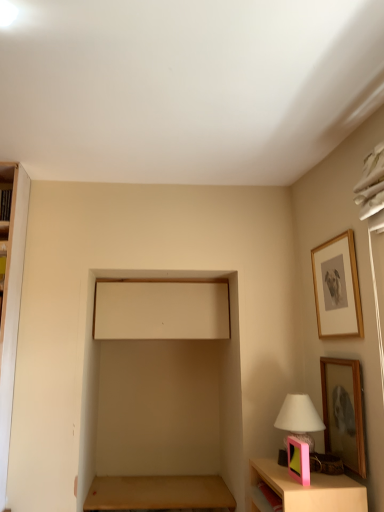
Question: From the image's perspective, does wooden picture frame at lower right, the 2th picture frame positioned from the top, appear lower than pink plastic table lamp at lower right?

Choices:
 (A) yes
 (B) no

Answer: (B)

Question: Can we say wooden picture frame at lower right, the second picture frame positioned from the right, lies outside pink plastic table lamp at lower right?

Choices:
 (A) yes
 (B) no

Answer: (A)

Question: From a real-world perspective, is wooden picture frame at lower right, the second picture frame positioned from the right, below pink plastic table lamp at lower right?

Choices:
 (A) no
 (B) yes

Answer: (A)

Question: Is the surface of wooden picture frame at lower right, the second picture frame positioned from the right, in direct contact with pink plastic table lamp at lower right?

Choices:
 (A) no
 (B) yes

Answer: (A)

Question: Considering the relative sizes of wooden picture frame at lower right, the 2th picture frame positioned from the top, and pink plastic table lamp at lower right in the image provided, is wooden picture frame at lower right, the 2th picture frame positioned from the top, thinner than pink plastic table lamp at lower right?

Choices:
 (A) yes
 (B) no

Answer: (A)

Question: Relative to pink plastic picture frame at lower right, which is the first picture frame in bottom-to-top order, is pink plastic table lamp at lower right in front or behind?

Choices:
 (A) behind
 (B) front

Answer: (A)

Question: Considering the relative positions of pink plastic table lamp at lower right and pink plastic picture frame at lower right, the third picture frame when ordered from top to bottom, in the image provided, is pink plastic table lamp at lower right to the left or to the right of pink plastic picture frame at lower right, the third picture frame when ordered from top to bottom,?

Choices:
 (A) left
 (B) right

Answer: (B)

Question: Is pink plastic table lamp at lower right wider or thinner than pink plastic picture frame at lower right, the third picture frame when ordered from top to bottom?

Choices:
 (A) wide
 (B) thin

Answer: (A)

Question: Looking at the image, does pink plastic table lamp at lower right seem bigger or smaller compared to pink plastic picture frame at lower right, the third picture frame viewed from the right?

Choices:
 (A) small
 (B) big

Answer: (B)

Question: Is brown wooden table at lower center to the left or to the right of wooden picture frame at lower right, positioned as the second picture frame in bottom-to-top order, in the image?

Choices:
 (A) left
 (B) right

Answer: (A)

Question: Is point (137, 492) closer or farther from the camera than point (327, 394)?

Choices:
 (A) closer
 (B) farther

Answer: (B)

Question: In the image, is brown wooden table at lower center positioned in front of or behind wooden picture frame at lower right, the second picture frame positioned from the right?

Choices:
 (A) front
 (B) behind

Answer: (B)

Question: Based on their sizes in the image, would you say brown wooden table at lower center is bigger or smaller than wooden picture frame at lower right, the second picture frame positioned from the right?

Choices:
 (A) big
 (B) small

Answer: (A)

Question: From the image's perspective, relative to pink plastic table lamp at lower right, is wooden picture frame at upper right, the first picture frame positioned from the right, above or below?

Choices:
 (A) below
 (B) above

Answer: (B)

Question: Is wooden picture frame at upper right, which is counted as the third picture frame, starting from the bottom, in front of or behind pink plastic table lamp at lower right in the image?

Choices:
 (A) front
 (B) behind

Answer: (A)